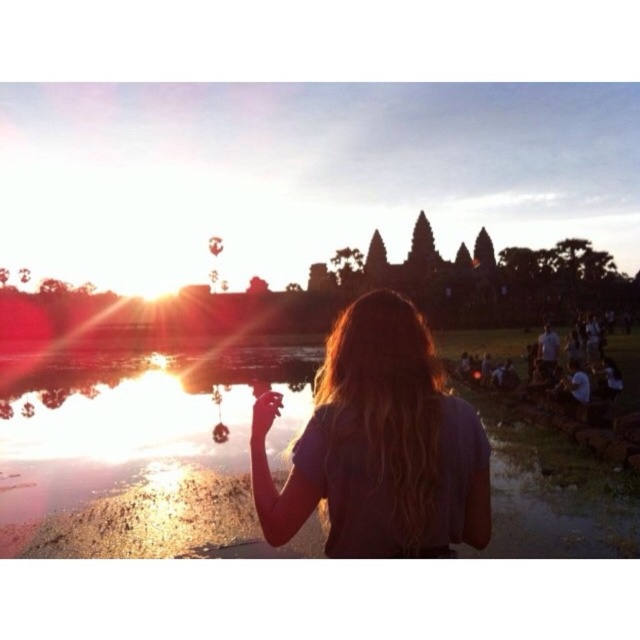
Looking at this image, you are standing at the temple of Angkor Wat and see the point marked at coordinates [140,451]. Based on the scene description, where exactly is this point located?

The point at coordinates [140,451] is located on the clear water at center.

You are a photographer positioned at point (330,492) and want to move to point (157,417) to get a better angle of the sunset at Angkor Wat. Is the path between these two points clear of any obstacles?

Point (157,417) is behind point (330,492), so moving from your current position at point (330,492) to point (157,417) would require moving backward. Since there are no obstacles mentioned in the scene description between these points, the path is clear.